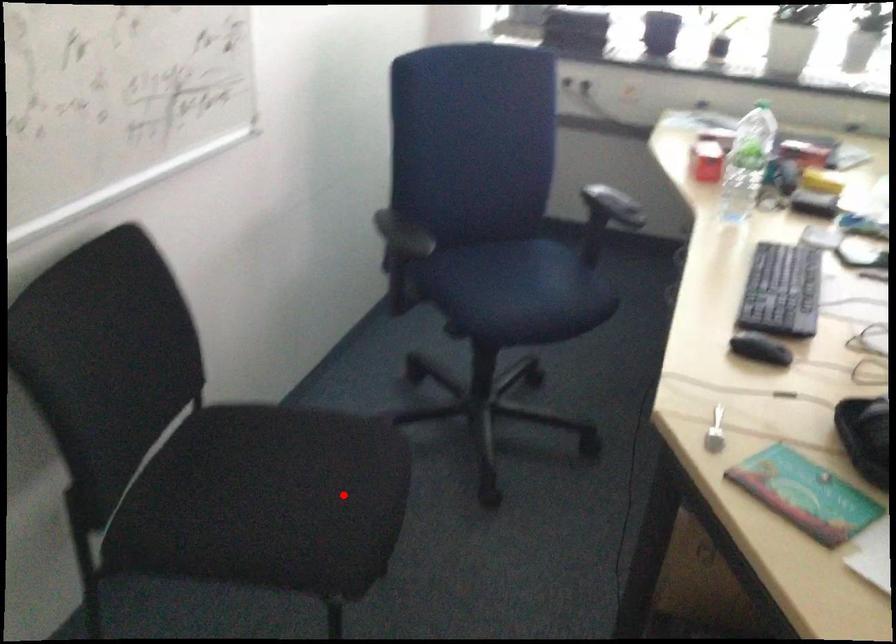
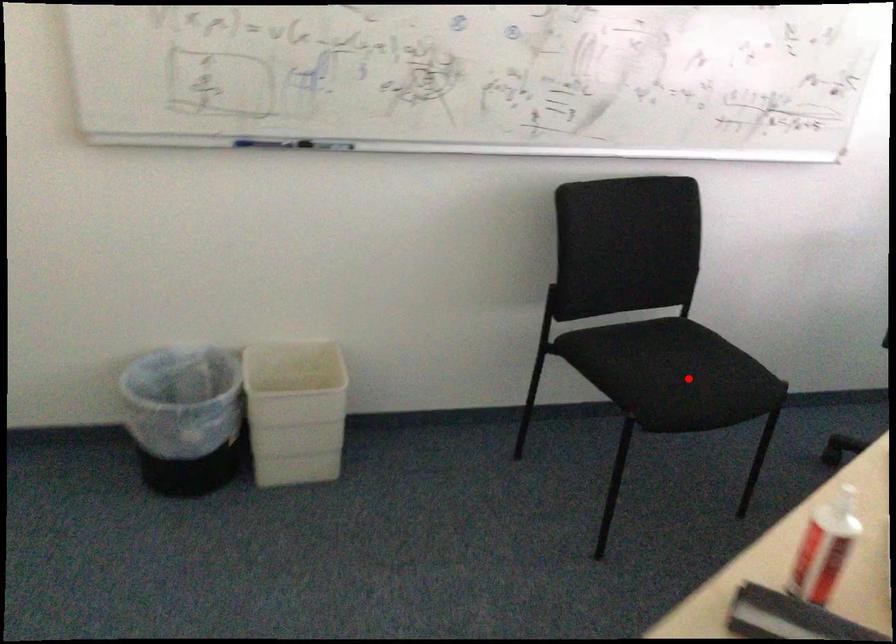
I am providing you with two images of the same scene from different viewpoints. A red point is marked on the first image and another point is marked on the second image. Is the red point in image1 aligned with the point shown in image2?

Yes